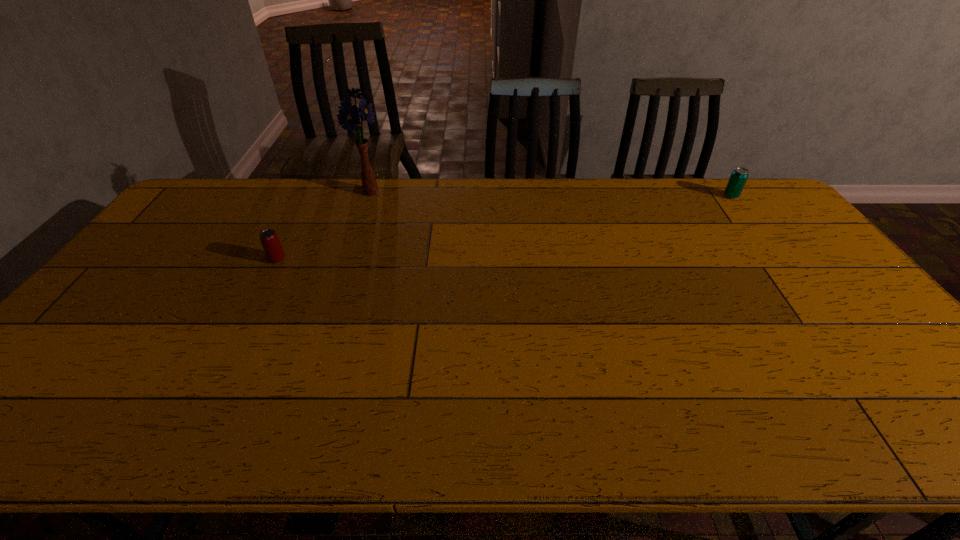
Identify the location of free space that satisfies the following two spatial constraints: 1. on the front side of the farther beer can; 2. on the right side of the flower arrangement. Image resolution: width=960 pixels, height=540 pixels. (369, 196).

Locate an element on the screen. vacant point that satisfies the following two spatial constraints: 1. on the back side of the rightmost object; 2. on the left side of the nearest object is located at coordinates (310, 196).

What are the coordinates of `vacant space that satisfies the following two spatial constraints: 1. on the front side of the farther beer can; 2. on the left side of the second object from right to left` in the screenshot? It's located at (369, 196).

Find the location of `blank space that satisfies the following two spatial constraints: 1. on the front side of the rightmost object; 2. on the left side of the flower arrangement`. blank space that satisfies the following two spatial constraints: 1. on the front side of the rightmost object; 2. on the left side of the flower arrangement is located at coordinates (369, 196).